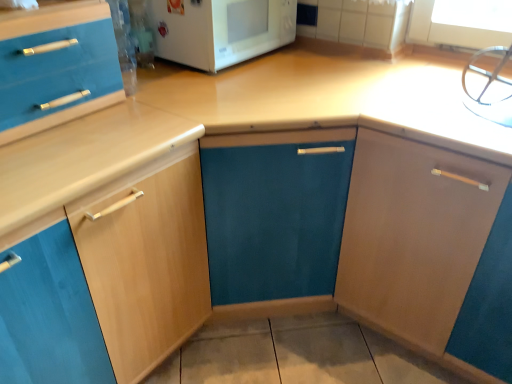
Question: Is light wood cabinet at left, arranged as the 2th cabinetry when viewed from the right, to the left of matte wood cabinet at right, which appears as the first cabinetry when viewed from the right, from the viewer's perspective?

Choices:
 (A) yes
 (B) no

Answer: (A)

Question: Is light wood cabinet at left, arranged as the 2th cabinetry when viewed from the right, thinner than matte wood cabinet at right, the second cabinetry viewed from the left?

Choices:
 (A) yes
 (B) no

Answer: (A)

Question: Is light wood cabinet at left, the 1th cabinetry positioned from the left, positioned with its back to matte wood cabinet at right, which appears as the first cabinetry when viewed from the right?

Choices:
 (A) no
 (B) yes

Answer: (A)

Question: From the image's perspective, does light wood cabinet at left, the 1th cabinetry positioned from the left, appear higher than matte wood cabinet at right, the second cabinetry viewed from the left?

Choices:
 (A) yes
 (B) no

Answer: (B)

Question: Is light wood cabinet at left, the 1th cabinetry positioned from the left, next to matte wood cabinet at right, the second cabinetry viewed from the left, and touching it?

Choices:
 (A) no
 (B) yes

Answer: (A)

Question: From a real-world perspective, is light wood cabinet at left, arranged as the 2th cabinetry when viewed from the right, under matte wood cabinet at right, which appears as the first cabinetry when viewed from the right?

Choices:
 (A) yes
 (B) no

Answer: (A)

Question: Can you confirm if matte wood cabinet at right, the second cabinetry viewed from the left, is smaller than light wood cabinet at left, arranged as the 2th cabinetry when viewed from the right?

Choices:
 (A) yes
 (B) no

Answer: (B)

Question: Can you confirm if matte wood cabinet at right, which appears as the first cabinetry when viewed from the right, is bigger than light wood cabinet at left, the 1th cabinetry positioned from the left?

Choices:
 (A) yes
 (B) no

Answer: (A)

Question: From a real-world perspective, does matte wood cabinet at right, which appears as the first cabinetry when viewed from the right, stand above light wood cabinet at left, the 1th cabinetry positioned from the left?

Choices:
 (A) no
 (B) yes

Answer: (B)

Question: From a real-world perspective, is matte wood cabinet at right, the second cabinetry viewed from the left, below light wood cabinet at left, arranged as the 2th cabinetry when viewed from the right?

Choices:
 (A) yes
 (B) no

Answer: (B)

Question: Does matte wood cabinet at right, the second cabinetry viewed from the left, have a greater width compared to light wood cabinet at left, arranged as the 2th cabinetry when viewed from the right?

Choices:
 (A) yes
 (B) no

Answer: (A)

Question: Is matte wood cabinet at right, the second cabinetry viewed from the left, aimed at light wood cabinet at left, arranged as the 2th cabinetry when viewed from the right?

Choices:
 (A) yes
 (B) no

Answer: (B)

Question: Is white glossy microwave at upper center completely or partially outside of light wood cabinet at left, the 1th cabinetry positioned from the left?

Choices:
 (A) no
 (B) yes

Answer: (B)